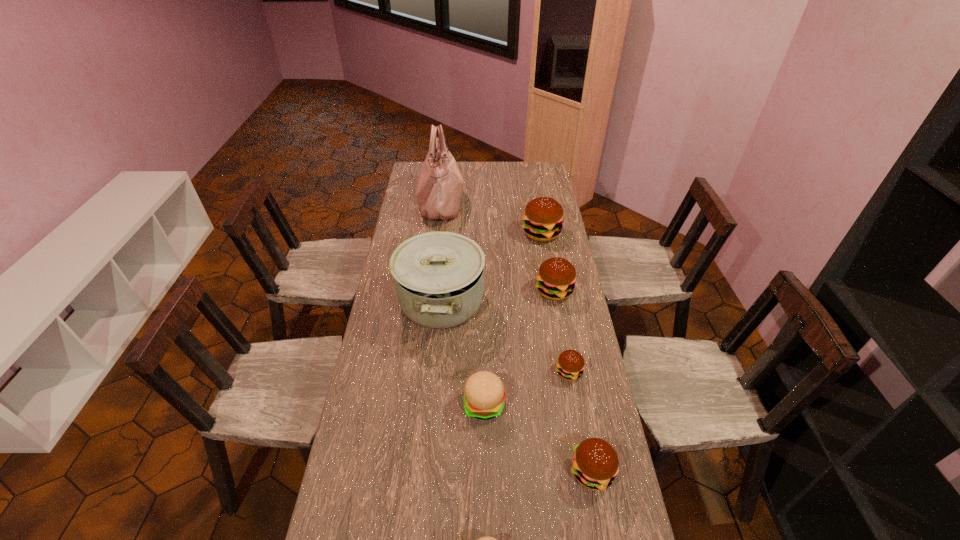
Locate an element on the screen. This screenshot has width=960, height=540. free space between the white saucepan and the fifth nearest hamburger is located at coordinates (497, 296).

Where is `free space that is in between the sixth shortest object and the bigger beige hamburger`? free space that is in between the sixth shortest object and the bigger beige hamburger is located at coordinates (513, 319).

Where is `empty space that is in between the third nearest hamburger and the smallest brown hamburger`? empty space that is in between the third nearest hamburger and the smallest brown hamburger is located at coordinates (526, 388).

In order to click on object that ranks as the closest to the second biggest brown hamburger in this screenshot , I will do `click(439, 276)`.

Locate which object is the closest to the nearest hamburger. Please provide its 2D coordinates. Your answer should be formatted as a tuple, i.e. [(x, y)], where the tuple contains the x and y coordinates of a point satisfying the conditions above.

[(595, 464)]

Choose which hamburger is the nearest neighbor to the second nearest object. Please provide its 2D coordinates. Your answer should be formatted as a tuple, i.e. [(x, y)], where the tuple contains the x and y coordinates of a point satisfying the conditions above.

[(484, 393)]

I want to click on the closest hamburger to the fourth nearest hamburger, so click(484, 393).

At what (x,y) coordinates should I click in order to perform the action: click on brown hamburger that stands as the closest to the nearest brown hamburger. Please return your answer as a coordinate pair (x, y). Looking at the image, I should click on (570, 364).

Find the location of a particular element. This screenshot has height=540, width=960. brown hamburger that is the second closest to the nearest brown hamburger is located at coordinates (556, 278).

What are the coordinates of `vacant space that satisfies the following two spatial constraints: 1. at the front of the seventh shortest object with handles; 2. on the right side of the handbag` in the screenshot? It's located at (429, 302).